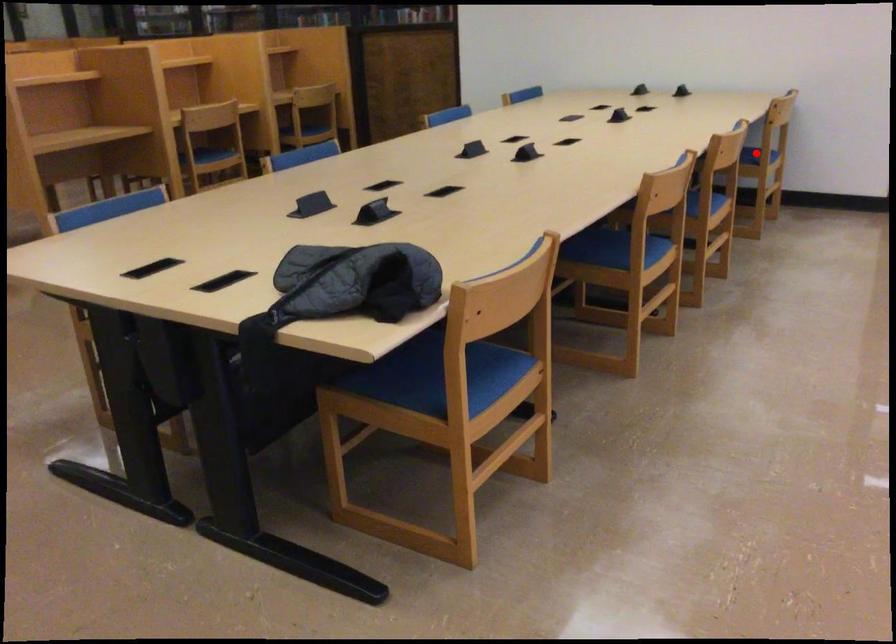
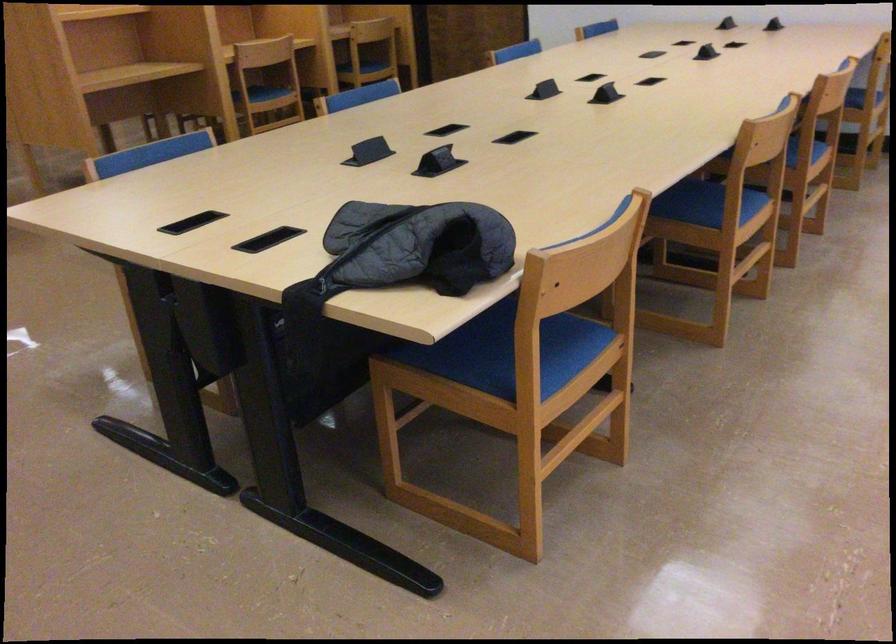
Question: I am providing you with two images of the same scene from different viewpoints. A red point is shown in image1. For the corresponding object point in image2, is it positioned nearer or farther from the camera?

Choices:
 (A) Nearer
 (B) Farther

Answer: (A)